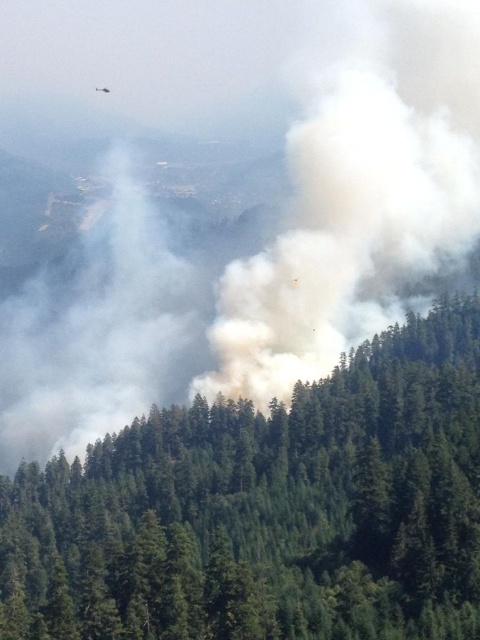
You are a firefighter assessing the scene from a safe distance. You notice the green textured trees at center and the white fluffy smoke at center. Which object is positioned lower in the image?

The green textured trees at center are positioned lower in the image than the white fluffy smoke at center.

You are a firefighter assessing the situation from a safe distance. You notice the green textured trees at center and the white fluffy smoke at center. Which object appears taller in the image?

The white fluffy smoke at center appears taller than the green textured trees at center because the description states that the green textured trees at center is shorter than the white fluffy smoke at center.

You are a firefighter trying to navigate through the forest fire scene. There is a point marked at coordinates (267, 509) which indicates green textured trees at center. Can you confirm if this area is safe to pass through?

The point at (267, 509) marks green textured trees at center, which are described as lush and dark green, appearing healthy and undisturbed except near the fire. Since the trees at this point are part of the healthy, undisturbed area, it is likely safe to pass through this area.